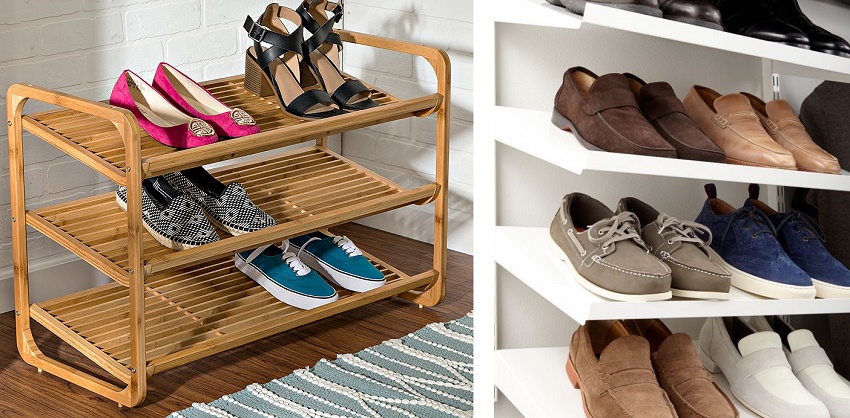
Identify the location of shelves. (502, 396), (522, 277), (528, 145), (525, 15).